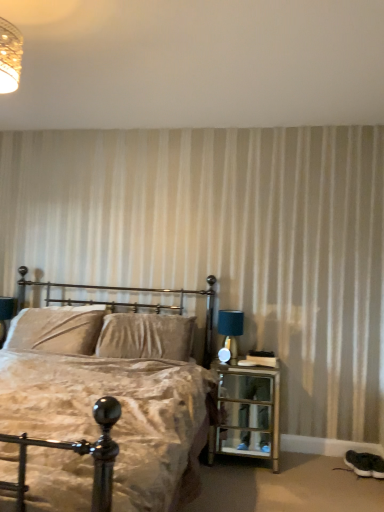
Question: Considering the relative sizes of velvet beige bed at center and white textured wall at upper center in the image provided, is velvet beige bed at center smaller than white textured wall at upper center?

Choices:
 (A) yes
 (B) no

Answer: (B)

Question: Is velvet beige bed at center in front of white textured wall at upper center?

Choices:
 (A) yes
 (B) no

Answer: (A)

Question: Are velvet beige bed at center and white textured wall at upper center far apart?

Choices:
 (A) yes
 (B) no

Answer: (A)

Question: Is velvet beige bed at center wider than white textured wall at upper center?

Choices:
 (A) no
 (B) yes

Answer: (B)

Question: Considering the relative sizes of velvet beige bed at center and white textured wall at upper center in the image provided, is velvet beige bed at center shorter than white textured wall at upper center?

Choices:
 (A) no
 (B) yes

Answer: (A)

Question: Is velvet beige bed at center in front of or behind velvet beige pillow at center, which is the 1th pillow in right-to-left order, in the image?

Choices:
 (A) behind
 (B) front

Answer: (B)

Question: Is velvet beige bed at center inside or outside of velvet beige pillow at center, which is the 1th pillow in right-to-left order?

Choices:
 (A) outside
 (B) inside

Answer: (A)

Question: Is velvet beige bed at center to the left or to the right of velvet beige pillow at center, which is the 1th pillow in right-to-left order, in the image?

Choices:
 (A) left
 (B) right

Answer: (A)

Question: Considering the positions of velvet beige bed at center and velvet beige pillow at center, which is the 1th pillow in right-to-left order, in the image, is velvet beige bed at center wider or thinner than velvet beige pillow at center, which is the 1th pillow in right-to-left order,?

Choices:
 (A) wide
 (B) thin

Answer: (A)

Question: Based on their sizes in the image, would you say white textured wall at upper center is bigger or smaller than velvet beige pillow at center, which is the second pillow from left to right?

Choices:
 (A) big
 (B) small

Answer: (A)

Question: From the image's perspective, is white textured wall at upper center above or below velvet beige pillow at center, which is the second pillow from left to right?

Choices:
 (A) above
 (B) below

Answer: (A)

Question: In terms of height, does white textured wall at upper center look taller or shorter compared to velvet beige pillow at center, which is the 1th pillow in right-to-left order?

Choices:
 (A) short
 (B) tall

Answer: (A)

Question: In the image, is white textured wall at upper center on the left side or the right side of velvet beige pillow at center, which is the 1th pillow in right-to-left order?

Choices:
 (A) right
 (B) left

Answer: (A)

Question: Considering the positions of point (236, 335) and point (56, 111), is point (236, 335) closer or farther from the camera than point (56, 111)?

Choices:
 (A) farther
 (B) closer

Answer: (A)

Question: From a real-world perspective, is blue fabric table lamp at right physically located above or below white textured wall at upper center?

Choices:
 (A) below
 (B) above

Answer: (A)